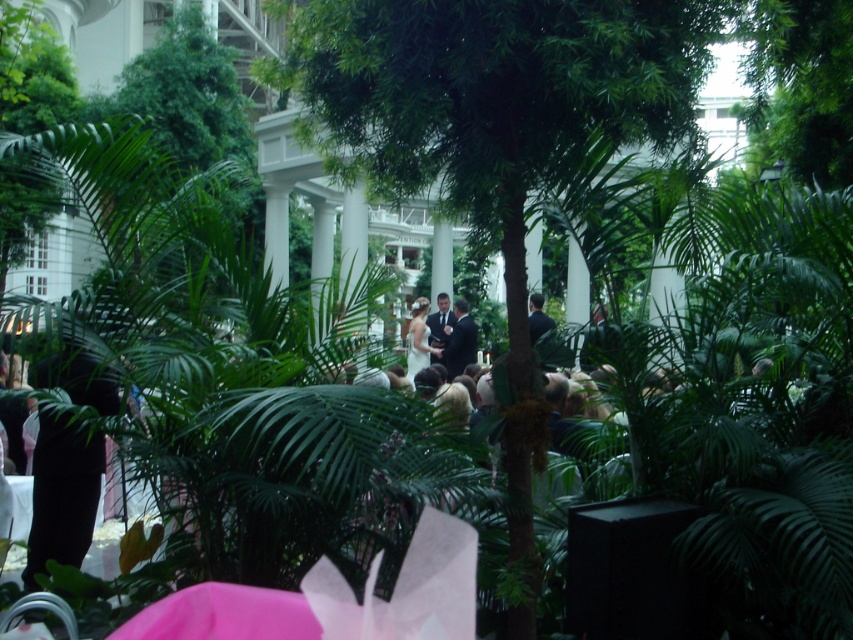
The height and width of the screenshot is (640, 853). What do you see at coordinates (460, 340) in the screenshot? I see `dark suit at center` at bounding box center [460, 340].

Is dark suit at center in front of white satin dress at center?

Yes, dark suit at center is closer to the viewer.

The height and width of the screenshot is (640, 853). What do you see at coordinates (460, 340) in the screenshot?
I see `dark suit at center` at bounding box center [460, 340].

Image resolution: width=853 pixels, height=640 pixels. I want to click on dark suit at center, so click(x=460, y=340).